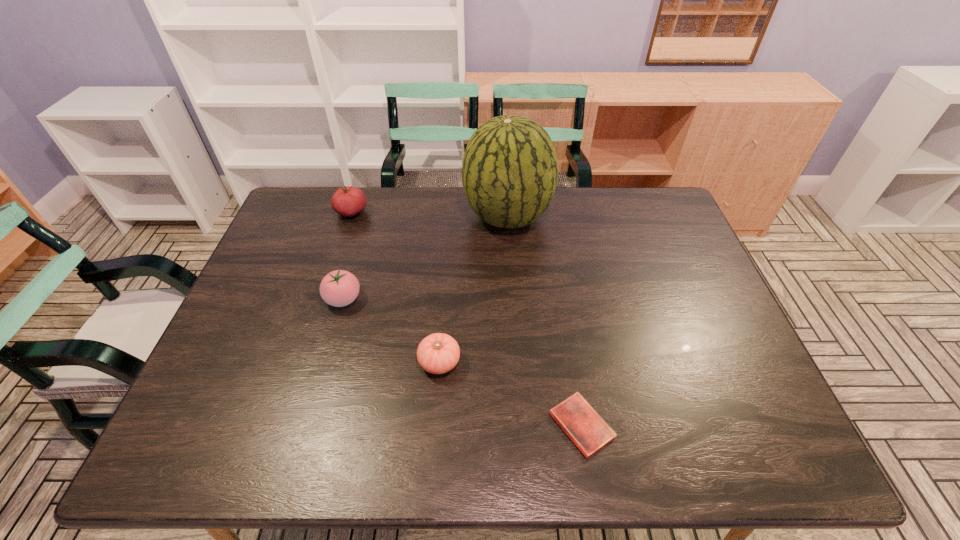
Where is `free spot between the farthest tomato and the shortest object`? This screenshot has height=540, width=960. free spot between the farthest tomato and the shortest object is located at coordinates (467, 319).

Identify which object is located as the fourth nearest to the second nearest object. Please provide its 2D coordinates. Your answer should be formatted as a tuple, i.e. [(x, y)], where the tuple contains the x and y coordinates of a point satisfying the conditions above.

[(347, 201)]

Identify the location of object that is the third closest one to the diary. This screenshot has width=960, height=540. (339, 288).

Identify which tomato is the nearest to the third nearest object. Please provide its 2D coordinates. Your answer should be formatted as a tuple, i.e. [(x, y)], where the tuple contains the x and y coordinates of a point satisfying the conditions above.

[(438, 353)]

Image resolution: width=960 pixels, height=540 pixels. In order to click on tomato that stands as the second closest to the third nearest object in this screenshot , I will do `click(347, 201)`.

The image size is (960, 540). Identify the location of vacant point that satisfies the following two spatial constraints: 1. on the front side of the shortest object; 2. on the right side of the farthest tomato. pyautogui.click(x=282, y=425).

Find the location of `vacant space that satisfies the following two spatial constraints: 1. on the front side of the third farthest object; 2. on the right side of the diary`. vacant space that satisfies the following two spatial constraints: 1. on the front side of the third farthest object; 2. on the right side of the diary is located at coordinates (307, 425).